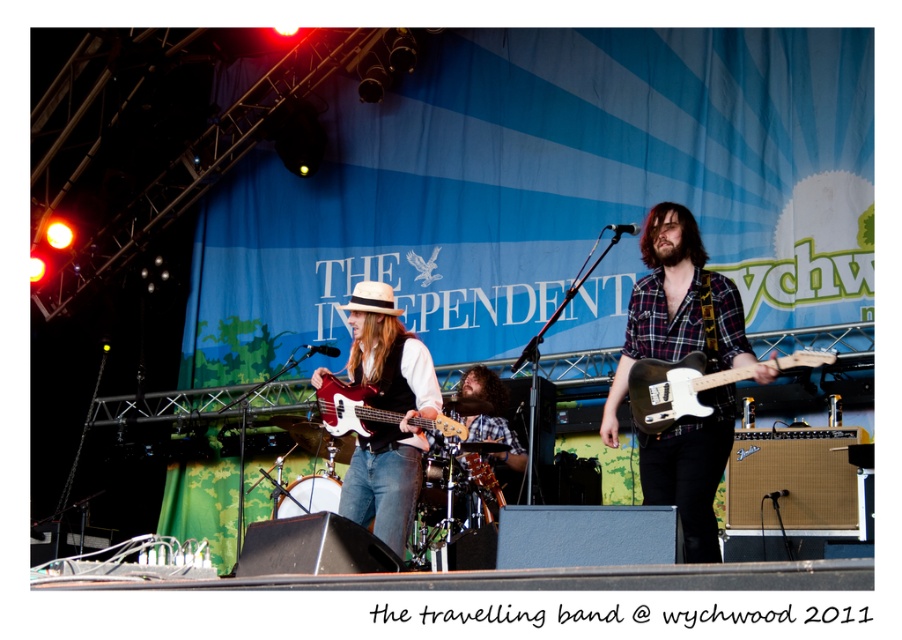
What are the coordinates of `matte red electric guitar at center` in the screenshot? It's located at (352, 408).

Can you confirm if matte red electric guitar at center is positioned to the left of glossy wood guitar at center?

Yes, matte red electric guitar at center is to the left of glossy wood guitar at center.

Describe the element at coordinates (352, 408) in the screenshot. I see `matte red electric guitar at center` at that location.

Image resolution: width=902 pixels, height=640 pixels. Identify the location of matte red electric guitar at center. (352, 408).

Which is more to the left, plaid fabric guitar at center or black matte electric guitar at center?

Positioned to the left is plaid fabric guitar at center.

Is plaid fabric guitar at center closer to the viewer compared to black matte electric guitar at center?

No, it is behind black matte electric guitar at center.

At what (x,y) coordinates should I click in order to perform the action: click on plaid fabric guitar at center. Please return your answer as a coordinate pair (x, y). This screenshot has height=640, width=902. Looking at the image, I should click on (676, 307).

Is point (391, 528) more distant than point (483, 506)?

That is False.

Which is behind, point (405, 397) or point (459, 461)?

The point (459, 461) is more distant.

This screenshot has width=902, height=640. I want to click on matte black bass guitar at center, so click(x=388, y=410).